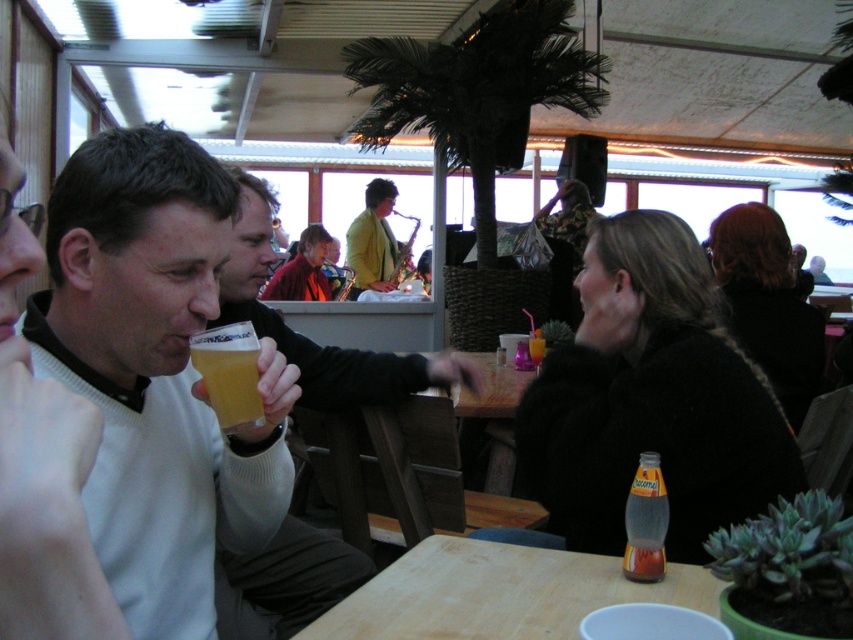
Question: Is matte yellow jacket at center to the left of matte red sweater at center from the viewer's perspective?

Choices:
 (A) no
 (B) yes

Answer: (A)

Question: Does dark brown hair at upper right appear under amber glass beer at center?

Choices:
 (A) no
 (B) yes

Answer: (A)

Question: Which point is closer to the camera?

Choices:
 (A) (117, 456)
 (B) (543, 348)

Answer: (A)

Question: Among these points, which one is nearest to the camera?

Choices:
 (A) (654, 515)
 (B) (230, 422)
 (C) (277, 284)

Answer: (B)

Question: Which of the following is the closest to the observer?

Choices:
 (A) (276, 275)
 (B) (640, 236)

Answer: (B)

Question: Is translucent glass bottle at table center above translucent plastic cup at table center?

Choices:
 (A) yes
 (B) no

Answer: (B)